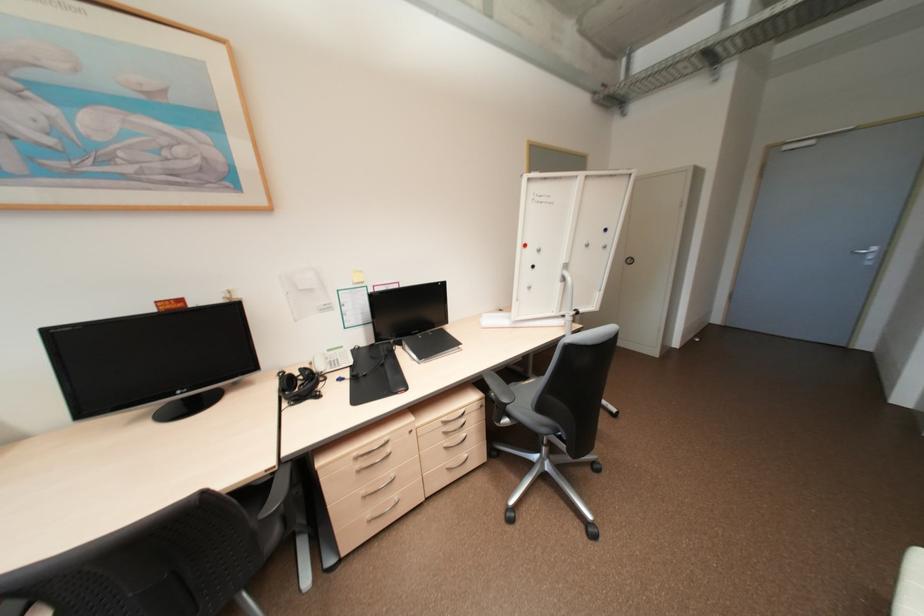
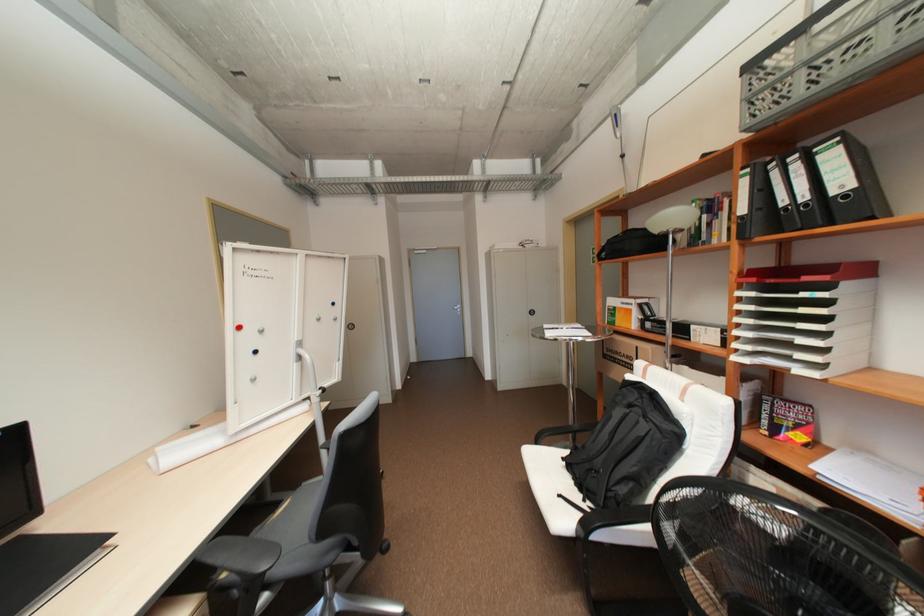
Question: The camera is either moving clockwise (left) or counter-clockwise (right) around the object. The first image is from the beginning of the video and the second image is from the end. Is the camera moving left or right when shooting the video?

Choices:
 (A) Left
 (B) Right

Answer: (A)